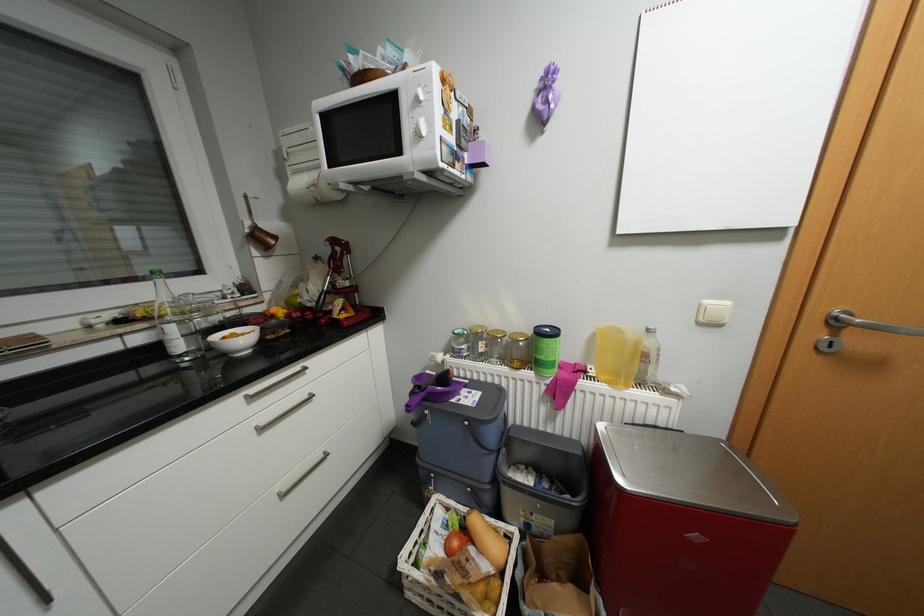
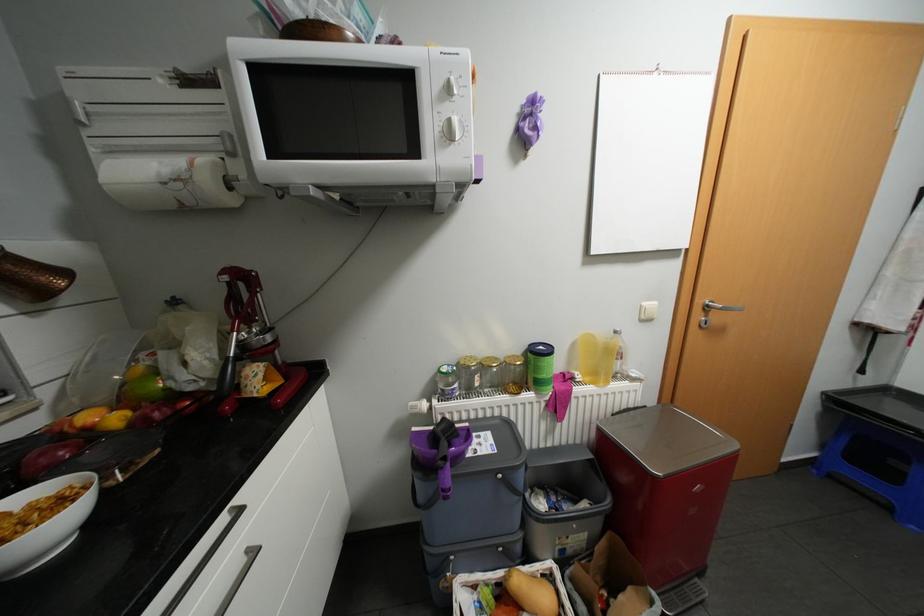
Locate, in the second image, the point that corresponds to (346,195) in the first image.

(239, 199)